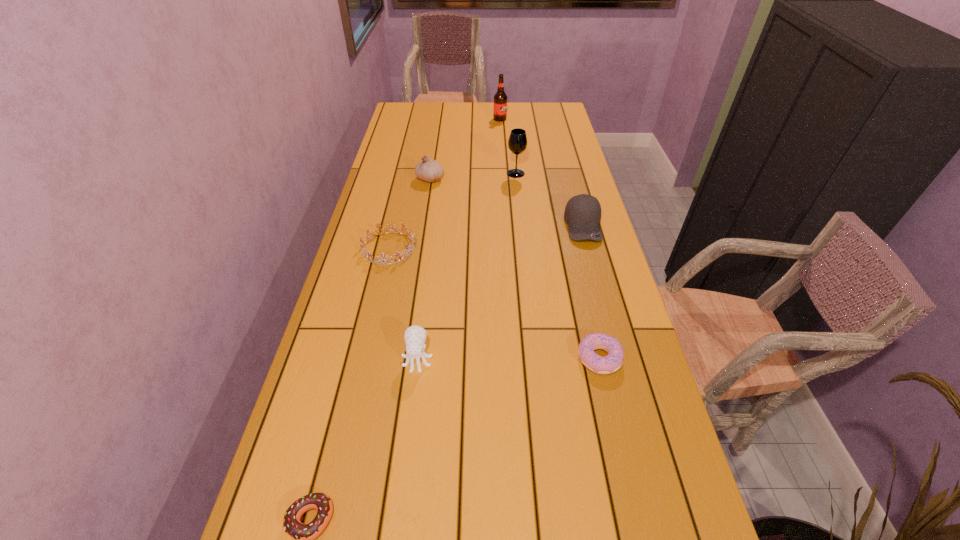
Locate an element on the screen. This screenshot has height=540, width=960. free space at the left edge of the desktop is located at coordinates (385, 218).

Locate an element on the screen. This screenshot has height=540, width=960. vacant space at the right edge of the desktop is located at coordinates (540, 161).

In the image, there is a desktop. Where is `vacant space at the far left corner`? vacant space at the far left corner is located at coordinates (411, 104).

This screenshot has height=540, width=960. In order to click on free space between the baseball cap and the farther doughnut in this screenshot , I will do `click(591, 292)`.

You are a GUI agent. You are given a task and a screenshot of the screen. Output one action in this format:
    pyautogui.click(x=<x>, y=<y>)
    Task: Click on the vacant area that lies between the garlic and the third shortest object
    The image size is (960, 540).
    Given the screenshot: What is the action you would take?
    pyautogui.click(x=410, y=213)

Image resolution: width=960 pixels, height=540 pixels. I want to click on vacant region between the wineglass and the root beer, so click(508, 146).

This screenshot has height=540, width=960. In order to click on unoccupied position between the right doughnut and the seventh shortest object in this screenshot , I will do `click(558, 266)`.

The image size is (960, 540). Identify the location of empty space between the tiara and the garlic. (410, 213).

At what (x,y) coordinates should I click in order to perform the action: click on vacant space that's between the baseball cap and the right doughnut. Please return your answer as a coordinate pair (x, y). The height and width of the screenshot is (540, 960). Looking at the image, I should click on (591, 292).

Locate an element on the screen. The height and width of the screenshot is (540, 960). object that is the third closest one to the baseball cap is located at coordinates (428, 170).